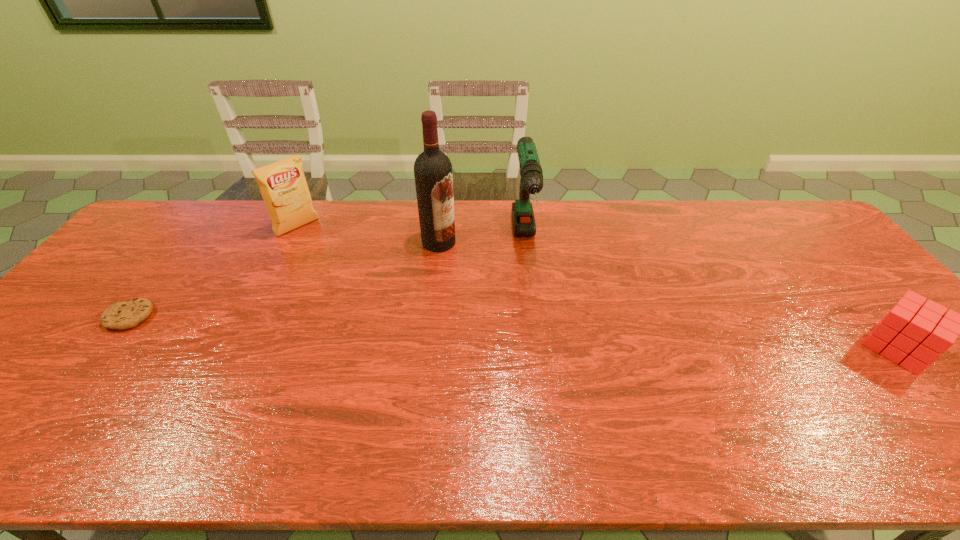
Where is `free spot between the second shortest object and the drill`? This screenshot has width=960, height=540. free spot between the second shortest object and the drill is located at coordinates (711, 295).

Where is `empty location between the rightmost object and the second object from right to left`? The width and height of the screenshot is (960, 540). empty location between the rightmost object and the second object from right to left is located at coordinates (711, 295).

Find the location of `free spot between the cube and the wine bottle`. free spot between the cube and the wine bottle is located at coordinates (668, 295).

Locate an element on the screen. The image size is (960, 540). free point between the tallest object and the third shortest object is located at coordinates (369, 235).

The width and height of the screenshot is (960, 540). I want to click on vacant area between the crisp (potato chip) and the second tallest object, so click(x=411, y=235).

The width and height of the screenshot is (960, 540). What are the coordinates of `unoccupied position between the crisp (potato chip) and the third object from left to right` in the screenshot? It's located at (369, 235).

Where is `free space between the crisp (potato chip) and the second tallest object`? Image resolution: width=960 pixels, height=540 pixels. free space between the crisp (potato chip) and the second tallest object is located at coordinates (411, 235).

The width and height of the screenshot is (960, 540). I want to click on free space between the fourth tallest object and the drill, so click(711, 295).

You are a GUI agent. You are given a task and a screenshot of the screen. Output one action in this format:
    pyautogui.click(x=<x>, y=<y>)
    Task: Click on the vacant area that lies between the second object from left to right and the cookie
    This screenshot has height=540, width=960.
    Given the screenshot: What is the action you would take?
    pyautogui.click(x=214, y=272)

The height and width of the screenshot is (540, 960). What are the coordinates of `free space between the second shortest object and the leftmost object` in the screenshot? It's located at [514, 332].